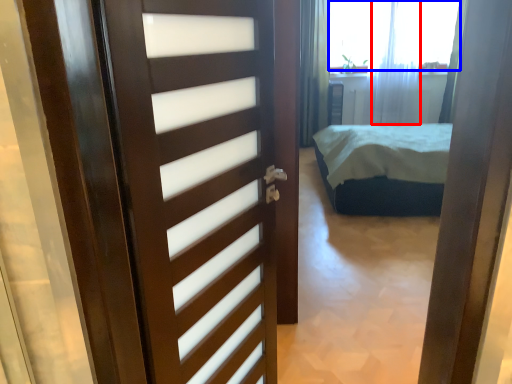
Question: Among these objects, which one is nearest to the camera, curtain (highlighted by a red box) or window screen (highlighted by a blue box)?

Choices:
 (A) curtain
 (B) window screen

Answer: (A)